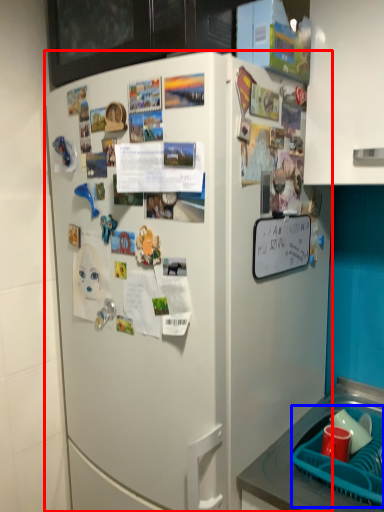
Question: Among these objects, which one is nearest to the camera, refrigerator (highlighted by a red box) or basket (highlighted by a blue box)?

Choices:
 (A) refrigerator
 (B) basket

Answer: (A)